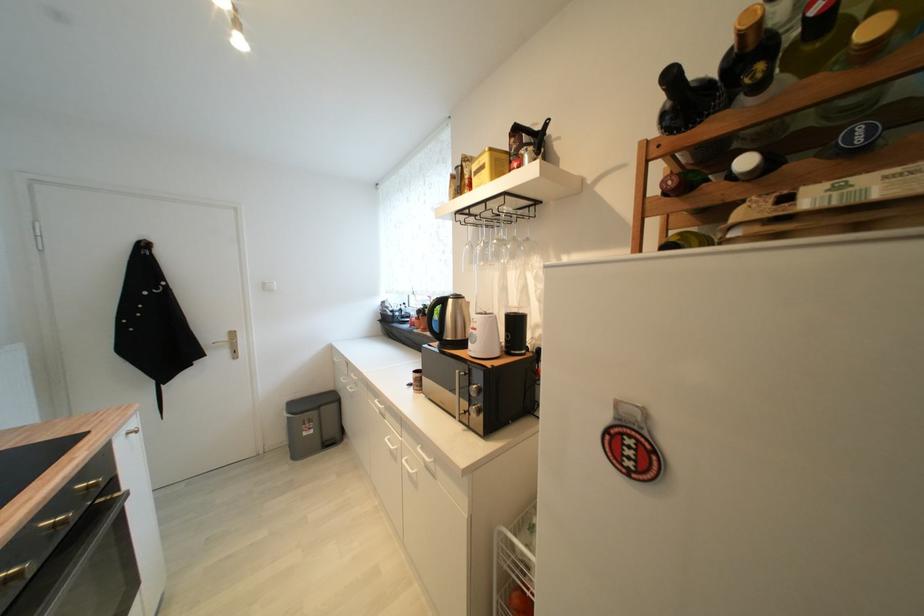
Find the location of a particular element. The image size is (924, 616). white light switch is located at coordinates (269, 285).